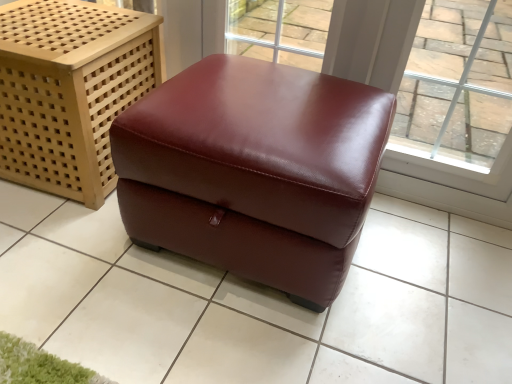
The height and width of the screenshot is (384, 512). I want to click on empty space that is ontop of burgundy leather ottoman at center, positioned as the second furniture in right-to-left order (from a real-world perspective), so click(x=60, y=20).